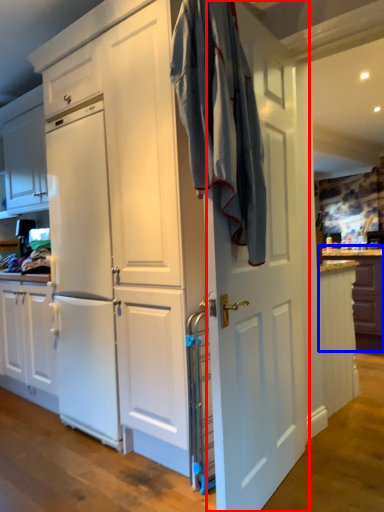
Question: Among these objects, which one is farthest to the camera, door (highlighted by a red box) or counter (highlighted by a blue box)?

Choices:
 (A) door
 (B) counter

Answer: (B)